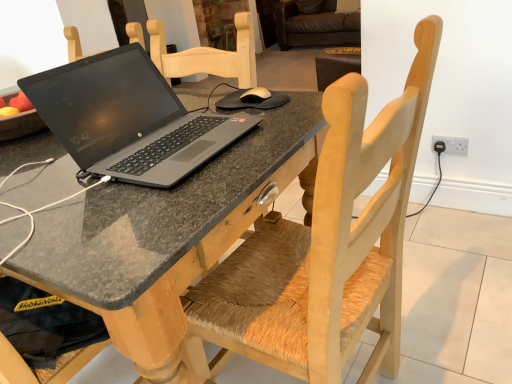
Question: Does white plastic electrical outlet at right lie in front of matte black laptop at center?

Choices:
 (A) yes
 (B) no

Answer: (B)

Question: Would you say white plastic electrical outlet at right is outside matte black laptop at center?

Choices:
 (A) no
 (B) yes

Answer: (B)

Question: Is white plastic electrical outlet at right thinner than matte black laptop at center?

Choices:
 (A) no
 (B) yes

Answer: (B)

Question: Is white plastic electrical outlet at right far away from matte black laptop at center?

Choices:
 (A) yes
 (B) no

Answer: (A)

Question: Is matte black laptop at center surrounded by white plastic electrical outlet at right?

Choices:
 (A) yes
 (B) no

Answer: (B)

Question: Is white plastic electrical outlet at right wider than matte black laptop at center?

Choices:
 (A) no
 (B) yes

Answer: (A)

Question: Considering the relative sizes of white plastic electrical outlet at right and granite table at center in the image provided, is white plastic electrical outlet at right shorter than granite table at center?

Choices:
 (A) yes
 (B) no

Answer: (A)

Question: From a real-world perspective, is white plastic electrical outlet at right beneath granite table at center?

Choices:
 (A) no
 (B) yes

Answer: (B)

Question: Does white plastic electrical outlet at right have a lesser width compared to granite table at center?

Choices:
 (A) yes
 (B) no

Answer: (A)

Question: Can you confirm if white plastic electrical outlet at right is bigger than granite table at center?

Choices:
 (A) no
 (B) yes

Answer: (A)

Question: Can you see white plastic electrical outlet at right touching granite table at center?

Choices:
 (A) no
 (B) yes

Answer: (A)

Question: Considering the relative positions of white plastic electrical outlet at right and granite table at center in the image provided, is white plastic electrical outlet at right to the left of granite table at center from the viewer's perspective?

Choices:
 (A) no
 (B) yes

Answer: (A)

Question: Is white plastic electrical outlet at right facing away from wooden chair with woven seat at center?

Choices:
 (A) no
 (B) yes

Answer: (A)